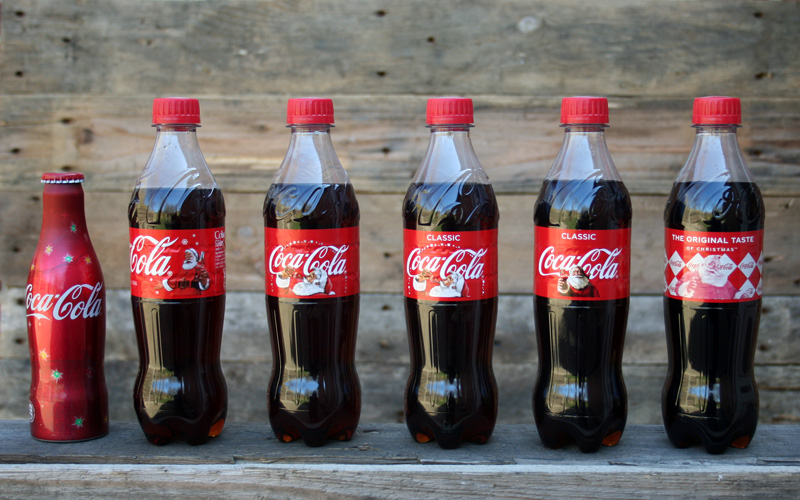
Locate an element on the screen. Image resolution: width=800 pixels, height=500 pixels. bottles of coke is located at coordinates (721, 273), (570, 268), (444, 266), (313, 278), (184, 269), (57, 295).